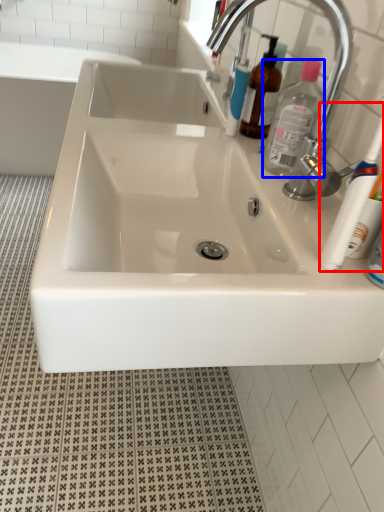
Question: Which object is closer to the camera taking this photo, toothbrush (highlighted by a red box) or cleaning product (highlighted by a blue box)?

Choices:
 (A) toothbrush
 (B) cleaning product

Answer: (A)